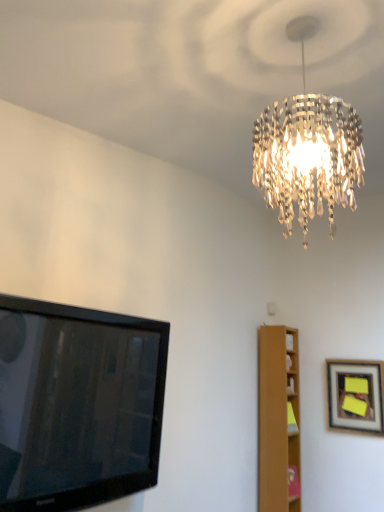
Question: Can you confirm if black glossy tv at left is thinner than wooden framed picture at right?

Choices:
 (A) yes
 (B) no

Answer: (B)

Question: Would you say black glossy tv at left is a long distance from wooden framed picture at right?

Choices:
 (A) yes
 (B) no

Answer: (A)

Question: From a real-world perspective, is black glossy tv at left located higher than wooden framed picture at right?

Choices:
 (A) yes
 (B) no

Answer: (B)

Question: From the image's perspective, does black glossy tv at left appear higher than wooden framed picture at right?

Choices:
 (A) yes
 (B) no

Answer: (A)

Question: Can you confirm if black glossy tv at left is taller than wooden framed picture at right?

Choices:
 (A) yes
 (B) no

Answer: (A)

Question: Is light brown wooden bookshelf at right bigger or smaller than black glossy tv at left?

Choices:
 (A) big
 (B) small

Answer: (B)

Question: Is light brown wooden bookshelf at right inside the boundaries of black glossy tv at left, or outside?

Choices:
 (A) inside
 (B) outside

Answer: (B)

Question: Is point coord(276,464) positioned closer to the camera than point coord(8,431)?

Choices:
 (A) farther
 (B) closer

Answer: (B)

Question: In terms of width, does light brown wooden bookshelf at right look wider or thinner when compared to black glossy tv at left?

Choices:
 (A) wide
 (B) thin

Answer: (A)

Question: In terms of size, does light brown wooden bookshelf at right appear bigger or smaller than wooden framed picture at right?

Choices:
 (A) small
 (B) big

Answer: (B)

Question: From their relative heights in the image, would you say light brown wooden bookshelf at right is taller or shorter than wooden framed picture at right?

Choices:
 (A) tall
 (B) short

Answer: (A)

Question: Visually, is light brown wooden bookshelf at right positioned to the left or to the right of wooden framed picture at right?

Choices:
 (A) right
 (B) left

Answer: (B)

Question: Looking at their shapes, would you say light brown wooden bookshelf at right is wider or thinner than wooden framed picture at right?

Choices:
 (A) thin
 (B) wide

Answer: (B)

Question: From a real-world perspective, is wooden framed picture at right physically located above or below black glossy tv at left?

Choices:
 (A) above
 (B) below

Answer: (A)

Question: Looking at the image, does wooden framed picture at right seem bigger or smaller compared to black glossy tv at left?

Choices:
 (A) small
 (B) big

Answer: (A)